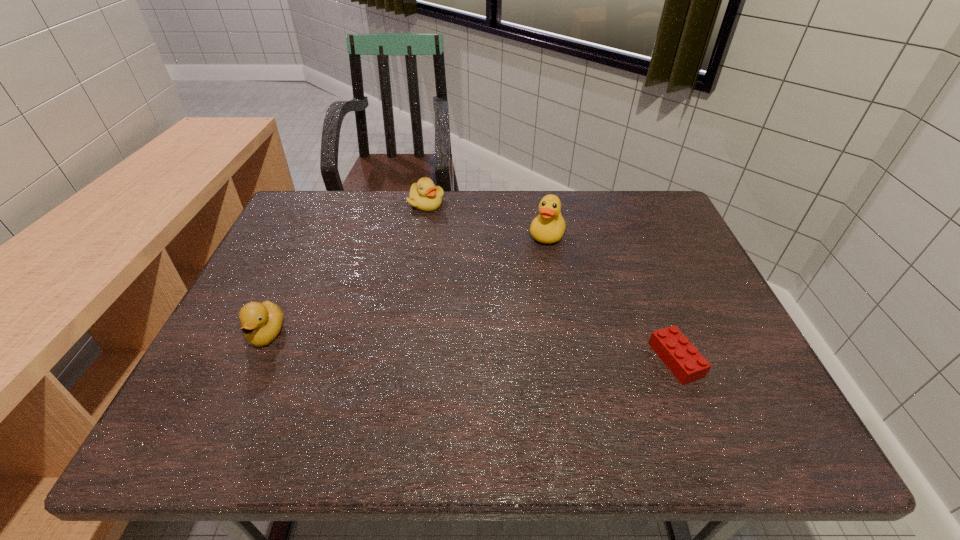
This screenshot has height=540, width=960. What are the coordinates of `vacant space in between the nearer duckling and the farthest object` in the screenshot? It's located at (347, 268).

Image resolution: width=960 pixels, height=540 pixels. Find the location of `vacant space in between the duck and the farther duckling`. vacant space in between the duck and the farther duckling is located at coordinates (487, 219).

The image size is (960, 540). In order to click on free spot between the rightmost object and the third nearest object in this screenshot , I will do `click(612, 297)`.

At what (x,y) coordinates should I click in order to perform the action: click on vacant space that's between the farther duckling and the third nearest object. Please return your answer as a coordinate pair (x, y). This screenshot has width=960, height=540. Looking at the image, I should click on (487, 219).

Locate an element on the screen. This screenshot has width=960, height=540. free space between the third object from right to left and the Lego is located at coordinates (551, 281).

This screenshot has height=540, width=960. I want to click on empty space between the left duckling and the rightmost object, so click(x=471, y=347).

In order to click on vacant space that's between the third nearest object and the third object from right to left in this screenshot , I will do `click(487, 219)`.

The width and height of the screenshot is (960, 540). What are the coordinates of `vacant region between the duck and the third object from right to left` in the screenshot? It's located at (487, 219).

Point out which object is positioned as the second nearest to the farthest object. Please provide its 2D coordinates. Your answer should be formatted as a tuple, i.e. [(x, y)], where the tuple contains the x and y coordinates of a point satisfying the conditions above.

[(261, 323)]

Identify the location of object that is the closest to the leftmost object. This screenshot has width=960, height=540. (424, 195).